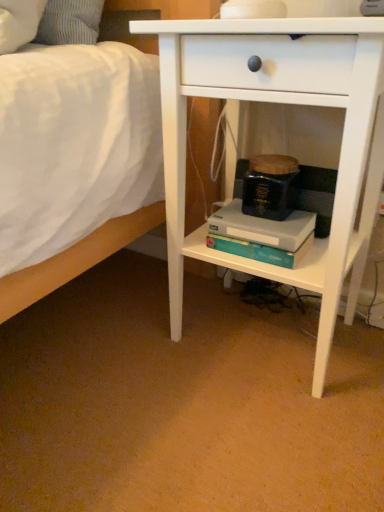
Image resolution: width=384 pixels, height=512 pixels. Find the location of `empty space that is ontop of teal matte paperback book at center, which is counted as the first paperback book, starting from the bottom`. empty space that is ontop of teal matte paperback book at center, which is counted as the first paperback book, starting from the bottom is located at coordinates (265, 218).